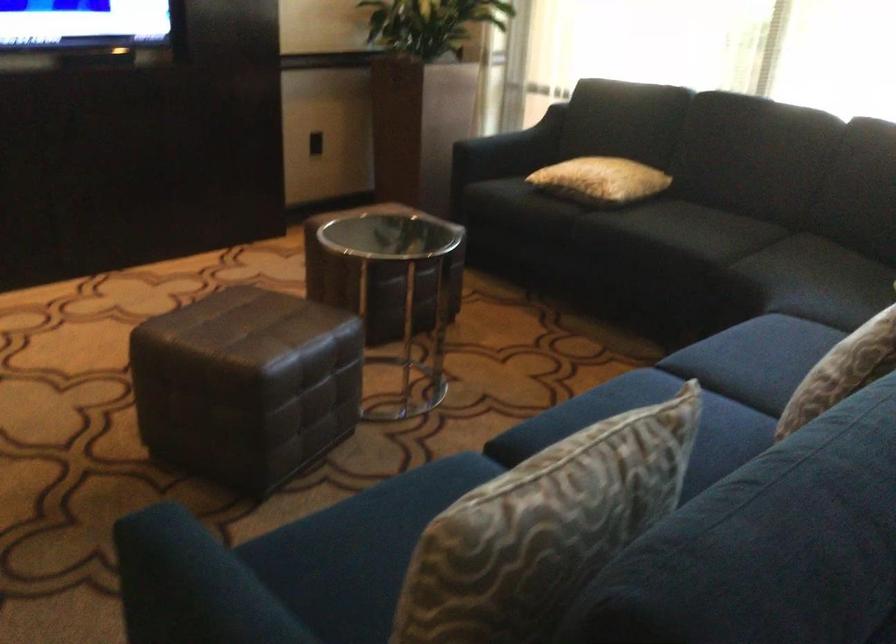
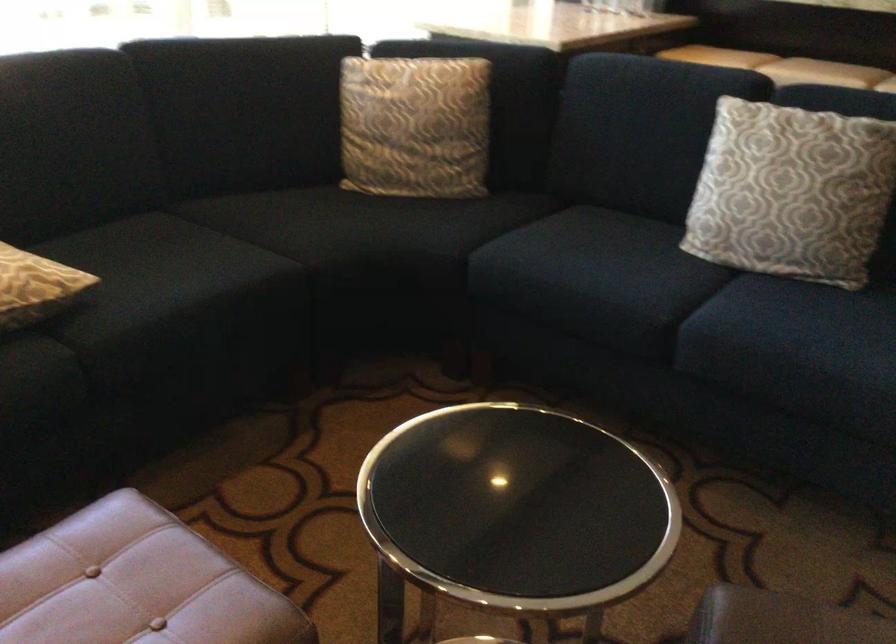
Where in the second image is the point corresponding to point 670,222 from the first image?

(161, 270)